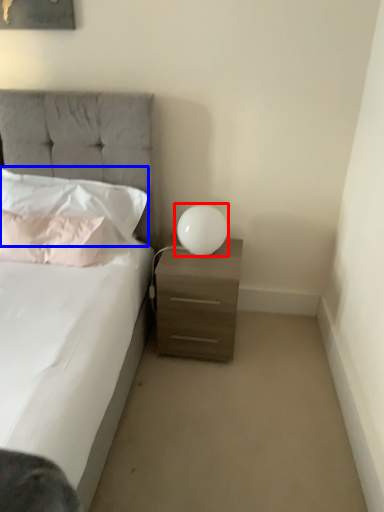
Question: Which object appears farthest to the camera in this image, table lamp (highlighted by a red box) or pillow (highlighted by a blue box)?

Choices:
 (A) table lamp
 (B) pillow

Answer: (A)